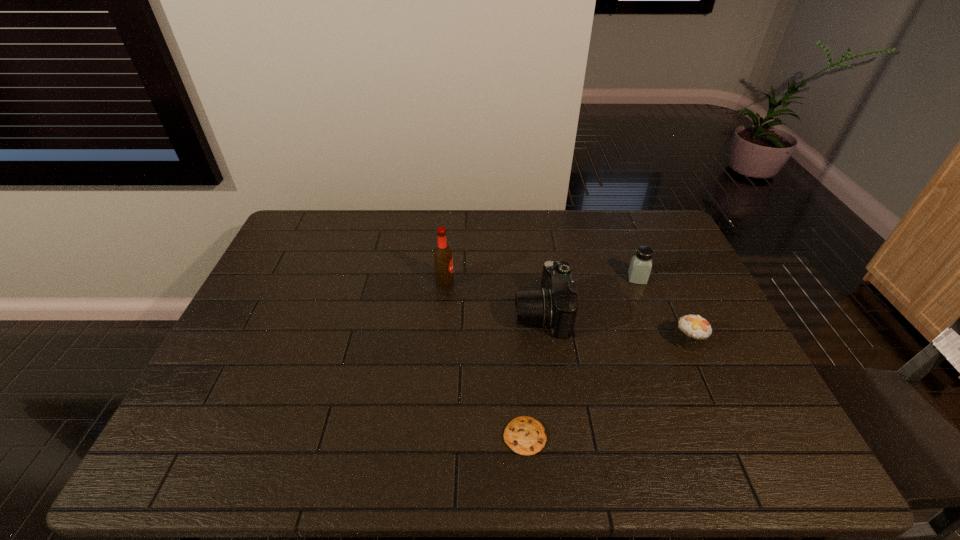
Image resolution: width=960 pixels, height=540 pixels. Identify the location of vacant space at the far right corner of the desktop. (633, 211).

You are a GUI agent. You are given a task and a screenshot of the screen. Output one action in this format:
    pyautogui.click(x=<x>, y=<y>)
    Task: Click on the vacant space at the near right corner of the desktop
    Image resolution: width=960 pixels, height=540 pixels.
    Given the screenshot: What is the action you would take?
    pyautogui.click(x=779, y=470)

This screenshot has height=540, width=960. I want to click on free spot between the saltshaker and the leftmost object, so click(540, 280).

Locate an element on the screen. empty space between the tallest object and the saltshaker is located at coordinates (540, 280).

At what (x,y) coordinates should I click in order to perform the action: click on free spot between the cookie and the second tallest object. Please return your answer as a coordinate pair (x, y). The image size is (960, 540). Looking at the image, I should click on (533, 375).

The width and height of the screenshot is (960, 540). What are the coordinates of `vacant area that lies between the leftmost object and the camera` in the screenshot? It's located at (493, 298).

Locate an element on the screen. vacant area that lies between the camera and the leftmost object is located at coordinates (493, 298).

Locate an element on the screen. free space between the leftmost object and the third shortest object is located at coordinates (540, 280).

Identify the location of empty space between the third tallest object and the fourth tallest object. (662, 310).

Where is `vacant space that is in between the beer bottle and the shortest object`? vacant space that is in between the beer bottle and the shortest object is located at coordinates (485, 359).